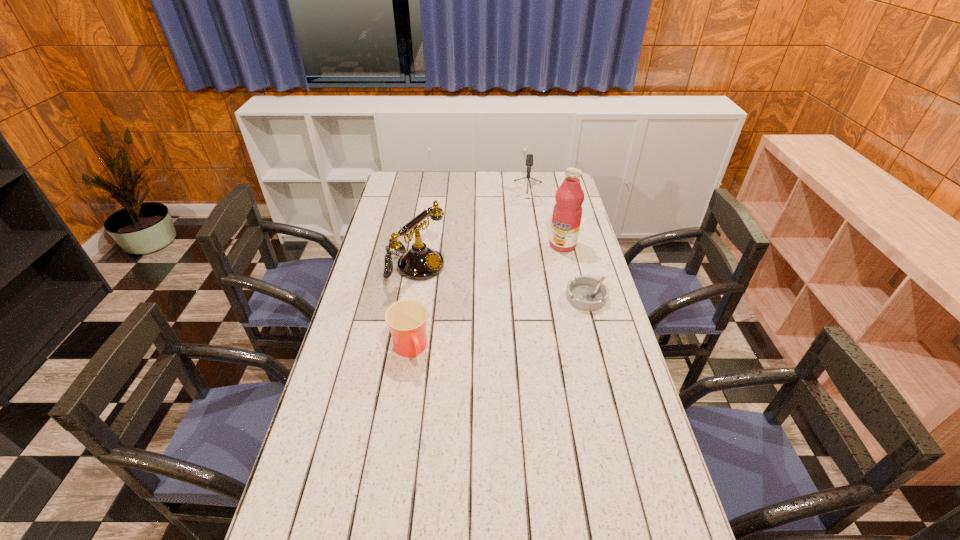
This screenshot has width=960, height=540. Identify the location of microphone present at the right edge. (529, 158).

Locate an element on the screen. This screenshot has height=540, width=960. object that is at the far right corner is located at coordinates (529, 158).

This screenshot has width=960, height=540. In the image, there is a desktop. In order to click on vacant region at the far edge in this screenshot , I will do [506, 173].

You are a GUI agent. You are given a task and a screenshot of the screen. Output one action in this format:
    pyautogui.click(x=<x>, y=<y>)
    Task: Click on the free space at the near edge of the desktop
    
    Given the screenshot: What is the action you would take?
    pyautogui.click(x=477, y=511)

This screenshot has height=540, width=960. I want to click on free region at the left edge of the desktop, so click(372, 282).

At what (x,y) coordinates should I click in order to perform the action: click on blank space at the right edge. Please return your answer as a coordinate pair (x, y). This screenshot has height=540, width=960. Looking at the image, I should click on (592, 357).

Image resolution: width=960 pixels, height=540 pixels. In order to click on free spot between the nearest object and the farthest object in this screenshot , I will do `click(468, 272)`.

Where is `free space that is in between the shortest object and the nearest object`? The height and width of the screenshot is (540, 960). free space that is in between the shortest object and the nearest object is located at coordinates (498, 323).

Where is `unoccupied area between the nearest object and the ashtray`? This screenshot has height=540, width=960. unoccupied area between the nearest object and the ashtray is located at coordinates [498, 323].

At what (x,y) coordinates should I click in order to perform the action: click on free space between the fourth shortest object and the microphone. Please return your answer as a coordinate pair (x, y). The image size is (960, 540). Looking at the image, I should click on (470, 230).